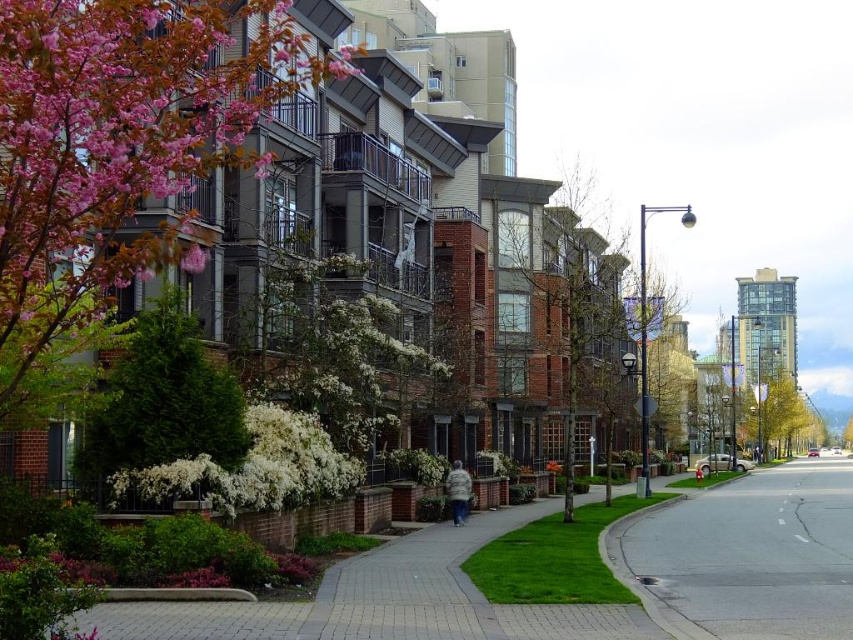
Does pink blossoms at left have a larger size compared to gray asphalt road at lower right?

No.

Can you confirm if pink blossoms at left is positioned to the right of gray asphalt road at lower right?

No, pink blossoms at left is not to the right of gray asphalt road at lower right.

Where is `pink blossoms at left`? This screenshot has width=853, height=640. pink blossoms at left is located at coordinates (117, 157).

The width and height of the screenshot is (853, 640). I want to click on pink blossoms at left, so click(x=117, y=157).

The height and width of the screenshot is (640, 853). What do you see at coordinates (117, 157) in the screenshot?
I see `pink blossoms at left` at bounding box center [117, 157].

Can you confirm if pink blossoms at left is bigger than paved brick sidewalk at center?

Yes.

Is point (61, 205) farther from viewer compared to point (376, 595)?

No, it is not.

What are the coordinates of `pink blossoms at left` in the screenshot? It's located at (117, 157).

Can you confirm if gray asphalt road at lower right is positioned to the right of green leafy tree at center?

Indeed, gray asphalt road at lower right is positioned on the right side of green leafy tree at center.

Between point (782, 554) and point (549, 444), which one is positioned behind?

Positioned behind is point (549, 444).

At what (x,y) coordinates should I click in order to perform the action: click on gray asphalt road at lower right. Please return your answer as a coordinate pair (x, y). Looking at the image, I should click on (747, 556).